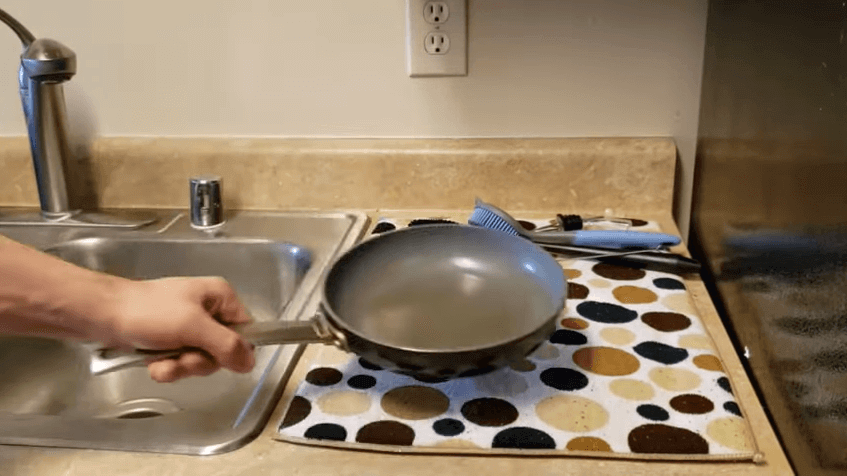
The image size is (847, 476). I want to click on outlet, so click(455, 24).